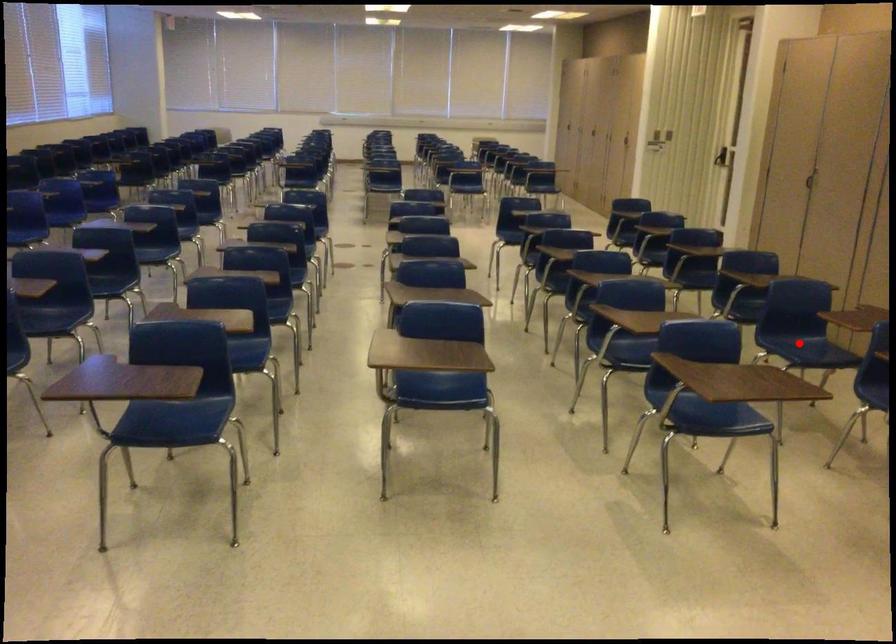
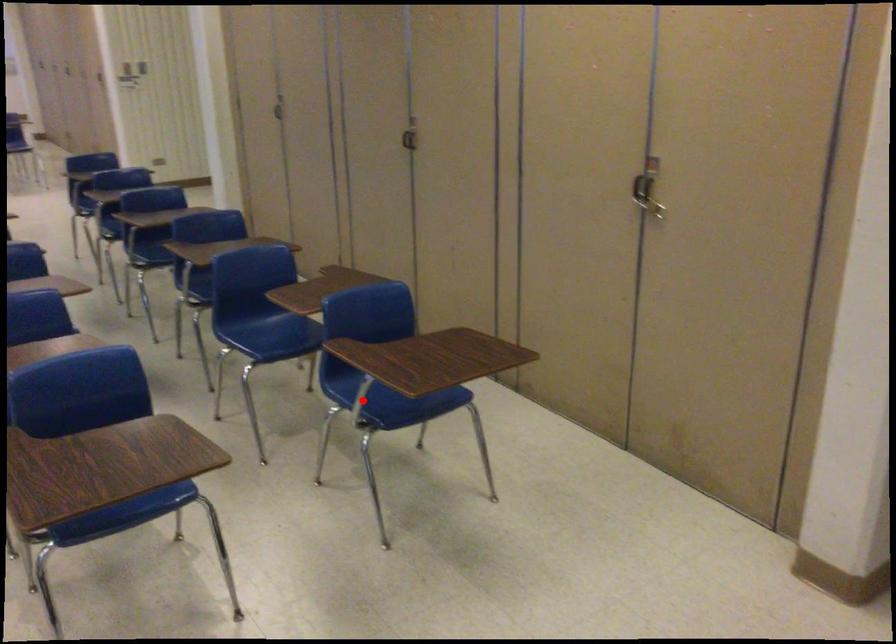
I am providing you with two images of the same scene from different viewpoints. A red point is marked on the first image and another point is marked on the second image. Is the red point in image1 aligned with the point shown in image2?

No